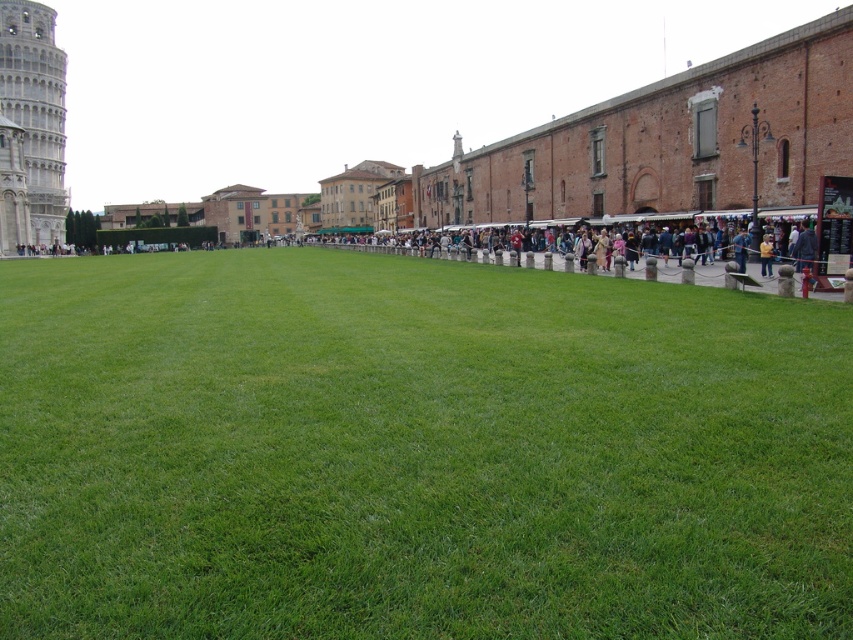
Does green grass at center appear on the left side of white stone tower at left?

Incorrect, green grass at center is not on the left side of white stone tower at left.

Which is in front, point (730, 580) or point (41, 22)?

Point (730, 580)

Does point (822, 449) come farther from viewer compared to point (13, 96)?

No, (822, 449) is in front of (13, 96).

Locate an element on the screen. The width and height of the screenshot is (853, 640). green grass at center is located at coordinates (415, 451).